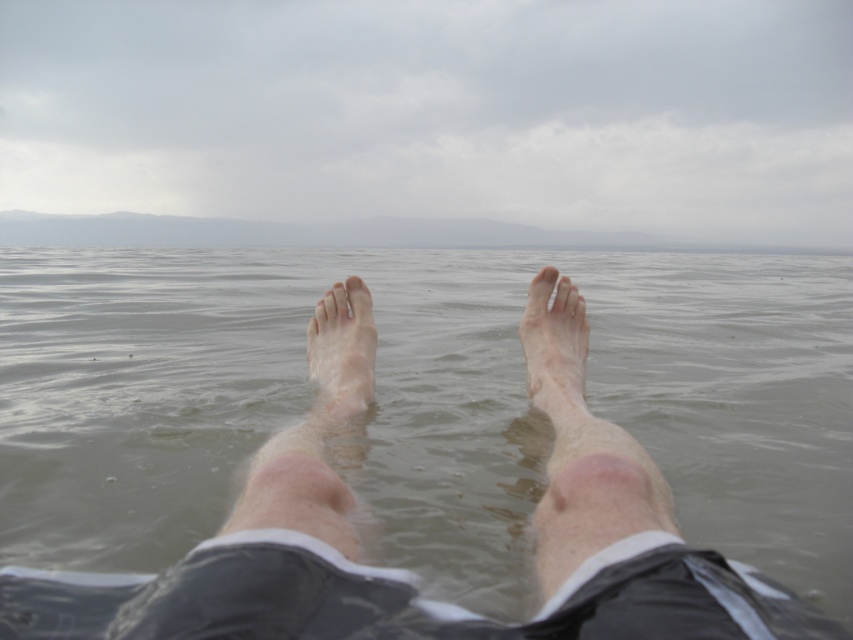
Question: Can you confirm if clear water at feet center is bigger than dry skin leg at center?

Choices:
 (A) yes
 (B) no

Answer: (A)

Question: Which is nearer to the dry skin foot at center?

Choices:
 (A) dry skin leg at center
 (B) pale skin foot at center
 (C) clear water at feet center

Answer: (A)

Question: Which of these objects is positioned farthest from the dry skin foot at center?

Choices:
 (A) clear water at feet center
 (B) pale skin foot at center

Answer: (A)

Question: Can you confirm if dry skin foot at center is smaller than pale skin foot at center?

Choices:
 (A) no
 (B) yes

Answer: (B)

Question: Can you confirm if clear water at feet center is bigger than pale skin foot at center?

Choices:
 (A) no
 (B) yes

Answer: (B)

Question: Among these objects, which one is nearest to the camera?

Choices:
 (A) dry skin foot at center
 (B) dry skin leg at center

Answer: (B)